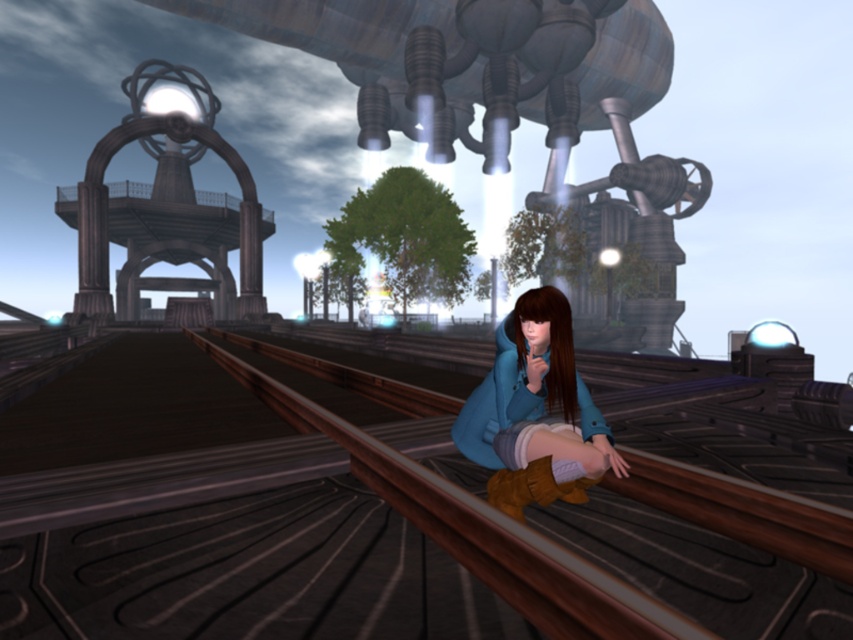
You are standing at the point marked as point (535, 412) in the image. What object is exactly at this point?

The blue suede boots at lower center are exactly at point (535, 412).

You are a delivery drone that needs to land on the surface where the brown leather boot at lower center is placed. Can the brown wooden train track at center provide enough space for the drone to land safely?

The brown wooden train track at center occupies less space than brown leather boot at lower center, so it cannot provide enough space for the drone to land safely.